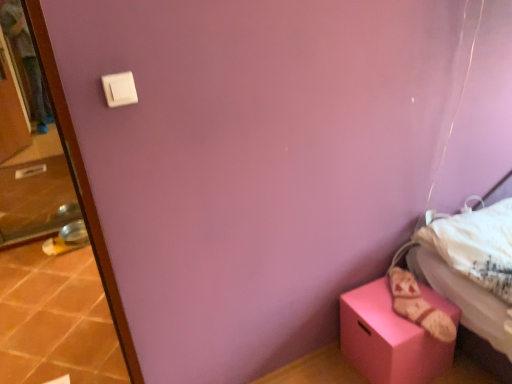
What are the coordinates of `free space above matte pink box at lower right (from a real-world perspective)` in the screenshot? It's located at pos(400,299).